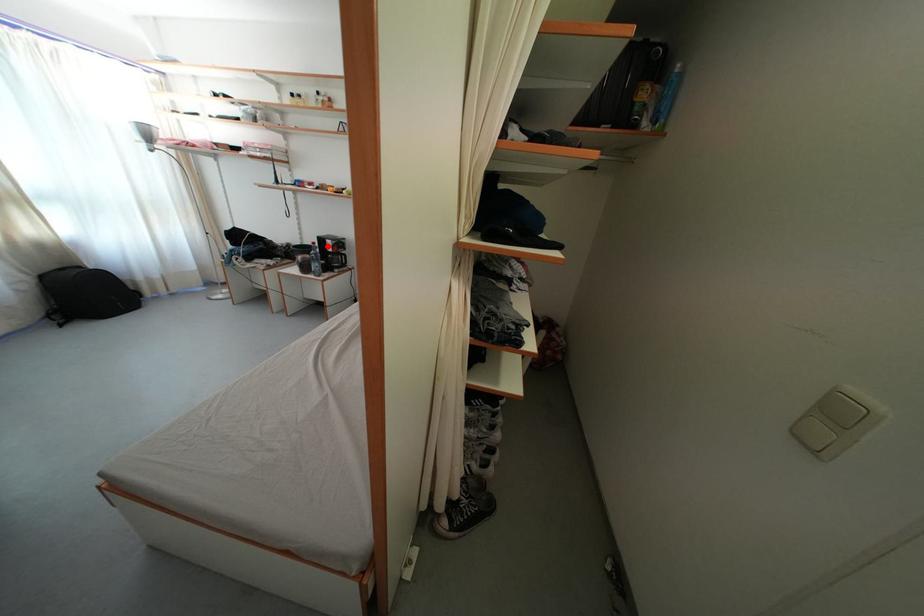
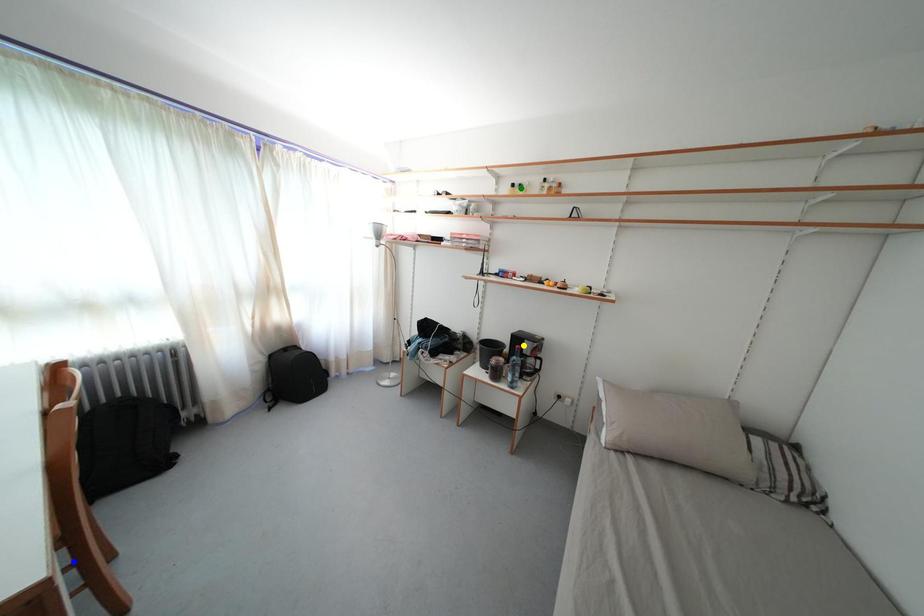
Question: I am providing you with two images of the same scene from different viewpoints. A red point is marked on the first image. You are given multiple points on the second image. Which spot in image 2 lines up with the point in image 1?

Choices:
 (A) blue point
 (B) green point
 (C) yellow point

Answer: (C)